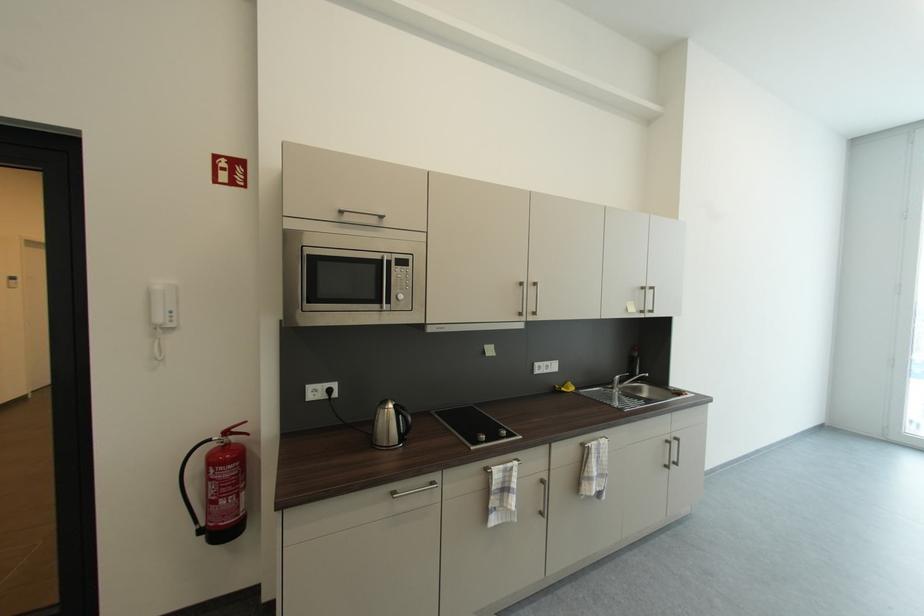
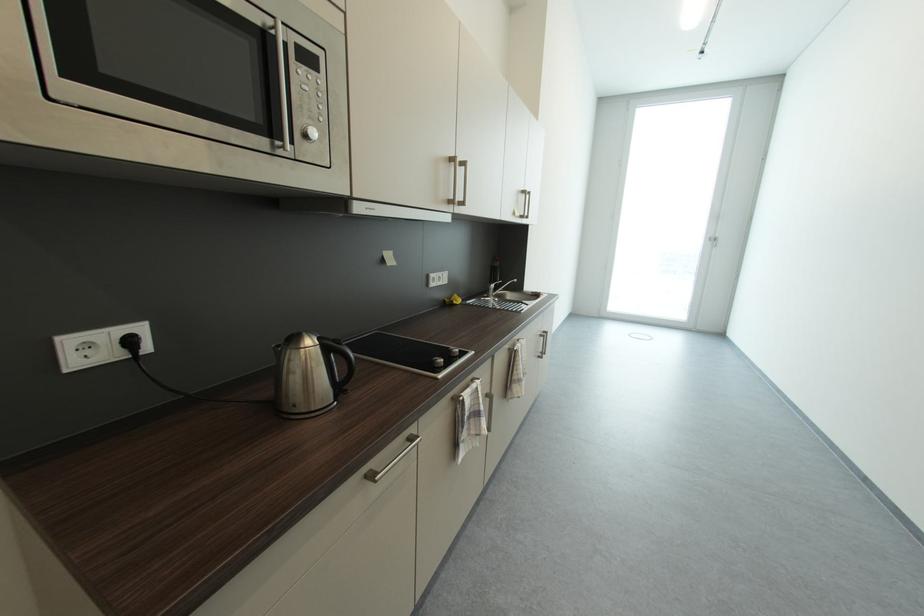
In the second image, find the point that corresponds to (x=527, y=315) in the first image.

(457, 204)